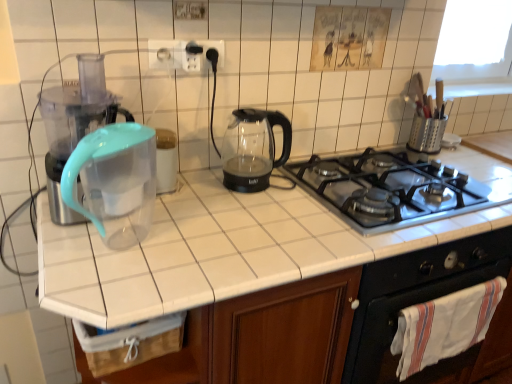
Find the location of a particular element. This screenshot has width=512, height=384. transparent glass kettle at center is located at coordinates (253, 149).

The width and height of the screenshot is (512, 384). What do you see at coordinates (253, 149) in the screenshot?
I see `transparent glass kettle at center` at bounding box center [253, 149].

Measure the distance between transparent plastic water filter pitcher at left and camera.

The depth of transparent plastic water filter pitcher at left is 31.20 inches.

What do you see at coordinates (218, 251) in the screenshot? This screenshot has width=512, height=384. I see `transparent plastic pitcher at left` at bounding box center [218, 251].

At what (x,y) coordinates should I click in order to perform the action: click on transparent glass kettle at center. Please return your answer as a coordinate pair (x, y). This screenshot has height=384, width=512. Looking at the image, I should click on (253, 149).

Does white plastic socket at upper center, the 1th electric outlet from the left, have a lesser height compared to metallic gray gas stove at center?

No.

Does point (153, 40) lie behind point (464, 175)?

No, it is not.

Which object is positioned more to the right, white plastic socket at upper center, the 2th electric outlet when ordered from right to left, or metallic gray gas stove at center?

From the viewer's perspective, metallic gray gas stove at center appears more on the right side.

Between white plastic socket at upper center, the 1th electric outlet from the left, and metallic gray gas stove at center, which one is positioned in front?

Positioned in front is metallic gray gas stove at center.

Would you consider metallic gray gas stove at center to be distant from transparent plastic pitcher at left?

That's not correct — metallic gray gas stove at center is a little close to transparent plastic pitcher at left.

Between metallic gray gas stove at center and transparent plastic pitcher at left, which one has larger size?

transparent plastic pitcher at left is bigger.

Which is in front, point (335, 178) or point (199, 286)?

Positioned in front is point (199, 286).

Can we say metallic gray gas stove at center lies outside transparent plastic pitcher at left?

No, most part of metallic gray gas stove at center lies within transparent plastic pitcher at left.

Is transparent plastic pitcher at left surrounding white plastic socket at upper center, the 2th electric outlet when ordered from right to left?

Actually, white plastic socket at upper center, the 2th electric outlet when ordered from right to left, is outside transparent plastic pitcher at left.

Which object is further away from the camera taking this photo, transparent plastic pitcher at left or white plastic socket at upper center, the 2th electric outlet when ordered from right to left?

Positioned behind is white plastic socket at upper center, the 2th electric outlet when ordered from right to left.

Which electric outlet is the 2nd one when counting from the left side of the transparent plastic pitcher at left? Please provide its 2D coordinates.

[(164, 54)]

At what (x,y) coordinates should I click in order to perform the action: click on gas stove that is behind the transparent plastic blender at left. Please return your answer as a coordinate pair (x, y). Looking at the image, I should click on (396, 189).

Does metallic gray gas stove at center turn towards transparent plastic blender at left?

No, metallic gray gas stove at center does not turn towards transparent plastic blender at left.

Does point (379, 230) come closer to viewer compared to point (97, 116)?

No, (379, 230) is further to viewer.

How different are the orientations of transparent glass kettle at center and metallic gray gas stove at center in degrees?

The angular difference between transparent glass kettle at center and metallic gray gas stove at center is 0.000919 degrees.

Consider the image. Is transparent glass kettle at center far away from metallic gray gas stove at center?

No, there isn't a large distance between transparent glass kettle at center and metallic gray gas stove at center.

Considering the points (246, 164) and (380, 196), which point is in front, point (246, 164) or point (380, 196)?

The point (380, 196) is more forward.

This screenshot has height=384, width=512. Find the location of `kitchen appliance above the metallic gray gas stove at center (from a real-world perspective)`. kitchen appliance above the metallic gray gas stove at center (from a real-world perspective) is located at coordinates (253, 149).

Identify the location of coffeepot in front of the white plastic socket at upper center, the 1th electric outlet from the left. (115, 181).

Can you tell me how much transparent plastic water filter pitcher at left and white plastic socket at upper center, the 1th electric outlet from the left, differ in facing direction?

They differ by 0.0016 degrees in their facing directions.

Can you confirm if transparent plastic water filter pitcher at left is thinner than white plastic socket at upper center, the 2th electric outlet when ordered from right to left?

No, transparent plastic water filter pitcher at left is not thinner than white plastic socket at upper center, the 2th electric outlet when ordered from right to left.

Is white plastic socket at upper center, the 1th electric outlet from the left, at the back of transparent plastic water filter pitcher at left?

No, transparent plastic water filter pitcher at left is not facing the opposite direction of white plastic socket at upper center, the 1th electric outlet from the left.

Which object is positioned more to the right, white plastic socket at upper center, the 2th electric outlet when ordered from right to left, or white plastic electric outlet at upper center, which ranks as the second electric outlet in left-to-right order?

white plastic electric outlet at upper center, which ranks as the second electric outlet in left-to-right order, is more to the right.

From a real-world perspective, is white plastic socket at upper center, the 1th electric outlet from the left, physically located above or below white plastic electric outlet at upper center, which ranks as the second electric outlet in left-to-right order?

From a real-world perspective, white plastic socket at upper center, the 1th electric outlet from the left, is physically below white plastic electric outlet at upper center, which ranks as the second electric outlet in left-to-right order.

Does white plastic socket at upper center, the 1th electric outlet from the left, have a larger size compared to white plastic electric outlet at upper center, placed as the first electric outlet when sorted from right to left?

Actually, white plastic socket at upper center, the 1th electric outlet from the left, might be smaller than white plastic electric outlet at upper center, placed as the first electric outlet when sorted from right to left.

How much distance is there between white plastic socket at upper center, the 1th electric outlet from the left, and white plastic electric outlet at upper center, placed as the first electric outlet when sorted from right to left?

white plastic socket at upper center, the 1th electric outlet from the left, is 2.48 inches away from white plastic electric outlet at upper center, placed as the first electric outlet when sorted from right to left.

You are a GUI agent. You are given a task and a screenshot of the screen. Output one action in this format:
    pyautogui.click(x=<x>, y=<y>)
    Task: Click on the 1st electric outlet above the metallic gray gas stove at center (from the image's perspective)
    The width and height of the screenshot is (512, 384).
    Given the screenshot: What is the action you would take?
    pyautogui.click(x=164, y=54)

Where is `gas stove on the left of transparent plastic pitcher at left`? gas stove on the left of transparent plastic pitcher at left is located at coordinates (396, 189).

Considering their positions, is transparent plastic blender at left positioned closer to transparent plastic pitcher at left than black matte oven at lower right?

black matte oven at lower right is closer to transparent plastic pitcher at left.

When comparing their distances from transparent glass kettle at center, does transparent plastic pitcher at left or white plastic socket at upper center, the 2th electric outlet when ordered from right to left, seem further?

white plastic socket at upper center, the 2th electric outlet when ordered from right to left, lies further to transparent glass kettle at center than the other object.

Considering their positions, is wooden crate at lower left positioned closer to white plastic electric outlet at upper center, which ranks as the second electric outlet in left-to-right order, than black matte oven at lower right?

Among the two, wooden crate at lower left is located nearer to white plastic electric outlet at upper center, which ranks as the second electric outlet in left-to-right order.

Estimate the real-world distances between objects in this image. Which object is further from transparent plastic pitcher at left, metallic gray gas stove at center or transparent glass kettle at center?

transparent glass kettle at center is positioned further to the anchor transparent plastic pitcher at left.

From the image, which object appears to be farther from transparent plastic pitcher at left, white plastic electric outlet at upper center, placed as the first electric outlet when sorted from right to left, or black matte oven at lower right?

white plastic electric outlet at upper center, placed as the first electric outlet when sorted from right to left, is further to transparent plastic pitcher at left.

Looking at the image, which one is located closer to transparent plastic water filter pitcher at left, white plastic socket at upper center, the 1th electric outlet from the left, or transparent plastic blender at left?

transparent plastic blender at left lies closer to transparent plastic water filter pitcher at left than the other object.

Looking at the image, which one is located closer to black matte oven at lower right, transparent plastic blender at left or transparent plastic pitcher at left?

transparent plastic pitcher at left is positioned closer to the anchor black matte oven at lower right.

From the image, which object appears to be nearer to wooden crate at lower left, transparent plastic water filter pitcher at left or white plastic socket at upper center, the 1th electric outlet from the left?

transparent plastic water filter pitcher at left is closer to wooden crate at lower left.

Where is `oven located between transparent glass kettle at center and transparent plastic pitcher at left in the left-right direction`? oven located between transparent glass kettle at center and transparent plastic pitcher at left in the left-right direction is located at coordinates (407, 291).

At what (x,y) coordinates should I click in order to perform the action: click on kitchen appliance between transparent plastic blender at left and black matte oven at lower right in the horizontal direction. Please return your answer as a coordinate pair (x, y). The width and height of the screenshot is (512, 384). Looking at the image, I should click on (253, 149).

I want to click on gas stove between transparent glass kettle at center and white cotton towel at lower right from top to bottom, so click(x=396, y=189).

You are a GUI agent. You are given a task and a screenshot of the screen. Output one action in this format:
    pyautogui.click(x=<x>, y=<y>)
    Task: Click on the oven between transparent plastic blender at left and white cotton towel at lower right in the horizontal direction
    
    Given the screenshot: What is the action you would take?
    pyautogui.click(x=407, y=291)